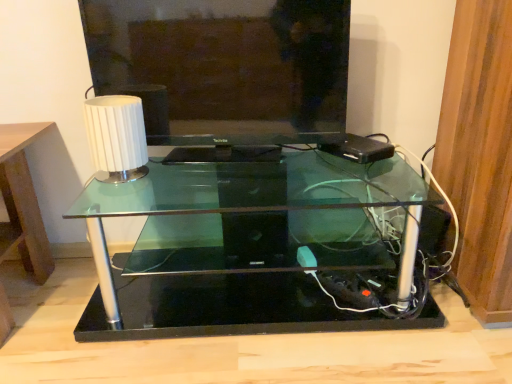
Question: Is matte black television at center to the left of white ribbed lampshade at upper left from the viewer's perspective?

Choices:
 (A) yes
 (B) no

Answer: (B)

Question: From the image's perspective, is matte black television at center over white ribbed lampshade at upper left?

Choices:
 (A) no
 (B) yes

Answer: (B)

Question: Can you confirm if matte black television at center is taller than white ribbed lampshade at upper left?

Choices:
 (A) yes
 (B) no

Answer: (A)

Question: From a real-world perspective, is matte black television at center below white ribbed lampshade at upper left?

Choices:
 (A) yes
 (B) no

Answer: (B)

Question: Is matte black television at center facing away from white ribbed lampshade at upper left?

Choices:
 (A) no
 (B) yes

Answer: (B)

Question: Does point (105, 213) appear closer or farther from the camera than point (98, 110)?

Choices:
 (A) farther
 (B) closer

Answer: (A)

Question: From the image's perspective, is transparent glass table at center positioned above or below white ribbed lampshade at upper left?

Choices:
 (A) above
 (B) below

Answer: (B)

Question: Is transparent glass table at center bigger or smaller than white ribbed lampshade at upper left?

Choices:
 (A) big
 (B) small

Answer: (A)

Question: Relative to white ribbed lampshade at upper left, is transparent glass table at center in front or behind?

Choices:
 (A) behind
 (B) front

Answer: (B)

Question: Looking at their shapes, would you say matte black television at center is wider or thinner than transparent glass table at center?

Choices:
 (A) thin
 (B) wide

Answer: (A)

Question: Considering their positions, is matte black television at center located in front of or behind transparent glass table at center?

Choices:
 (A) behind
 (B) front

Answer: (A)

Question: From the image's perspective, is matte black television at center above or below transparent glass table at center?

Choices:
 (A) below
 (B) above

Answer: (B)

Question: Is point (188, 13) closer or farther from the camera than point (281, 319)?

Choices:
 (A) farther
 (B) closer

Answer: (B)

Question: Considering the positions of transparent glass table at center and matte black television at center in the image, is transparent glass table at center wider or thinner than matte black television at center?

Choices:
 (A) wide
 (B) thin

Answer: (A)

Question: Does point (106, 319) appear closer or farther from the camera than point (240, 51)?

Choices:
 (A) farther
 (B) closer

Answer: (B)